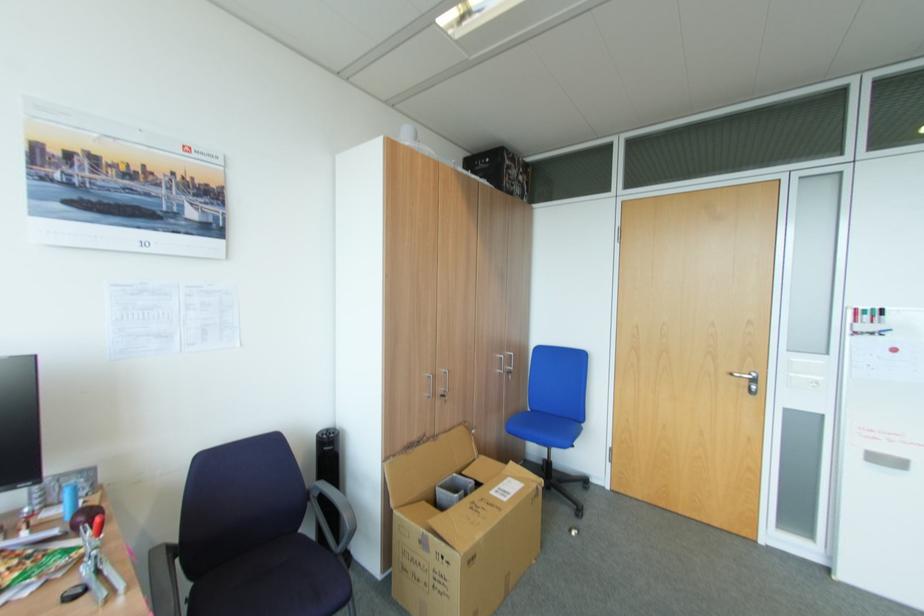
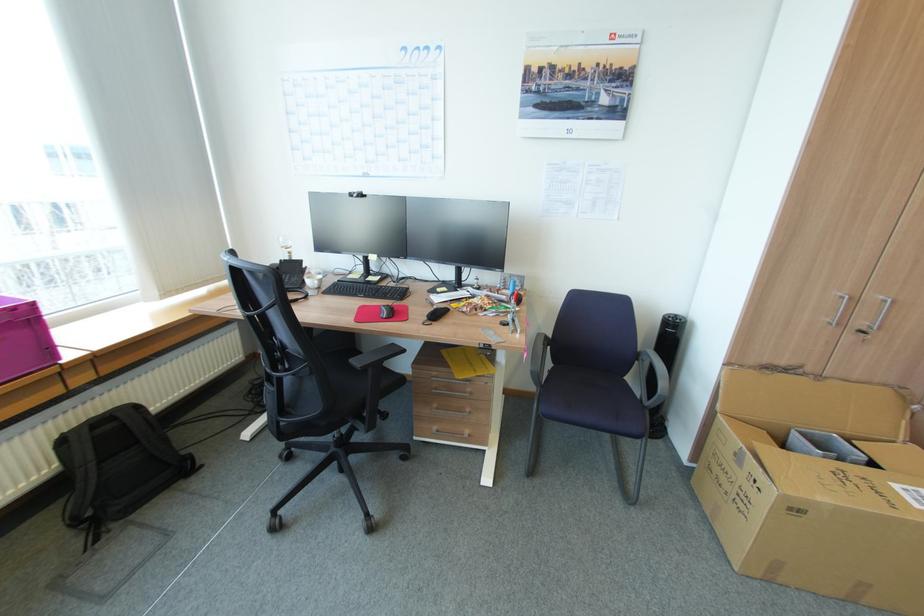
Locate, in the second image, the point that corresponds to the point at 479,556 in the first image.

(804, 511)